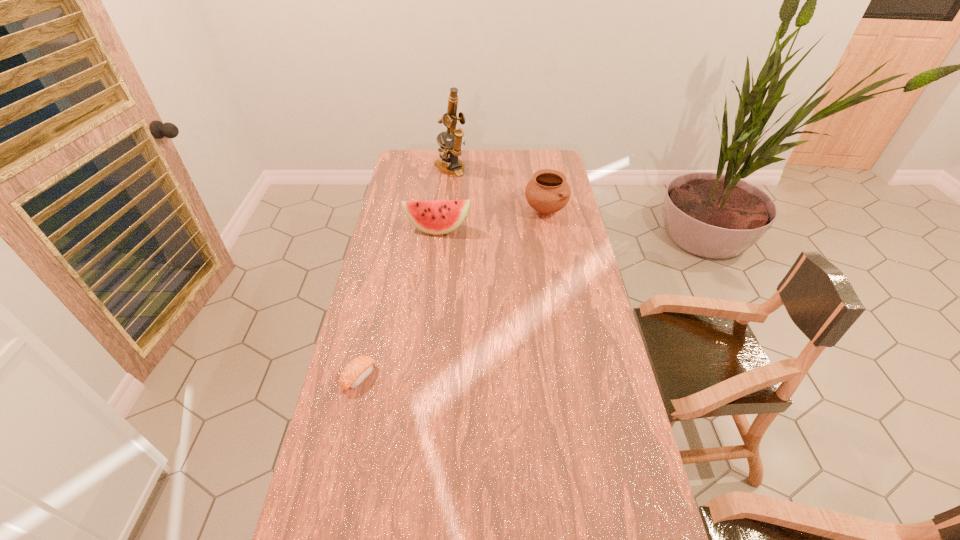
Locate an element on the screen. The height and width of the screenshot is (540, 960). free spot between the farthest object and the watermelon is located at coordinates (444, 199).

Locate an element on the screen. unoccupied position between the nearest object and the watermelon is located at coordinates (398, 303).

The image size is (960, 540). In order to click on blank region between the nearest object and the watermelon in this screenshot , I will do `click(398, 303)`.

At what (x,y) coordinates should I click in order to perform the action: click on free area in between the watermelon and the sushi. Please return your answer as a coordinate pair (x, y). The image size is (960, 540). Looking at the image, I should click on (398, 303).

The width and height of the screenshot is (960, 540). I want to click on free space between the microscope and the shortest object, so click(x=405, y=273).

The image size is (960, 540). What are the coordinates of `vacant space in between the shortest object and the pottery` in the screenshot? It's located at (452, 293).

Locate an element on the screen. The image size is (960, 540). vacant area between the rightmost object and the watermelon is located at coordinates (492, 219).

Image resolution: width=960 pixels, height=540 pixels. Identify the location of vacant space in between the farthest object and the watermelon. (444, 199).

At what (x,y) coordinates should I click in order to perform the action: click on vacant region between the sushi and the pottery. Please return your answer as a coordinate pair (x, y). Looking at the image, I should click on (452, 293).

Identify which object is located as the second nearest to the microscope. Please provide its 2D coordinates. Your answer should be formatted as a tuple, i.e. [(x, y)], where the tuple contains the x and y coordinates of a point satisfying the conditions above.

[(437, 217)]